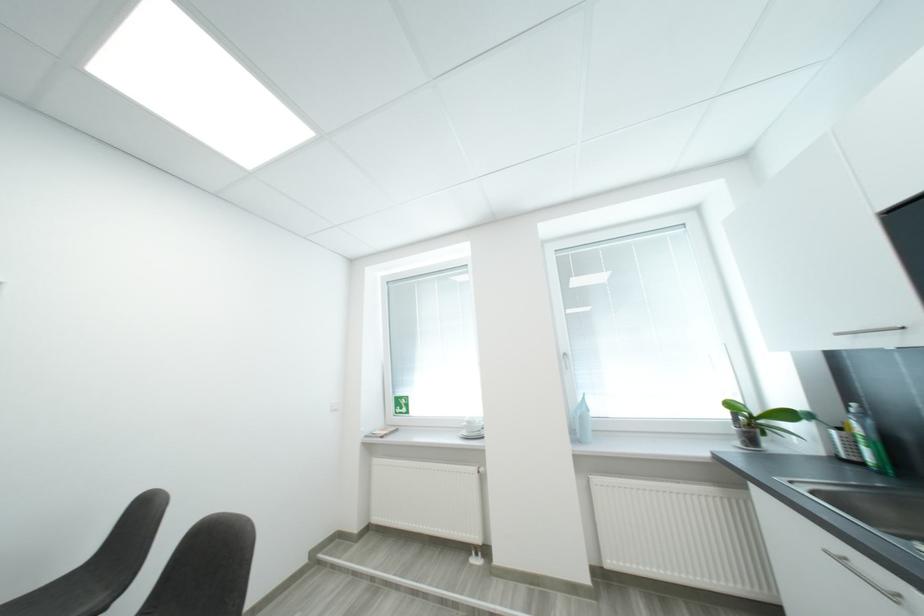
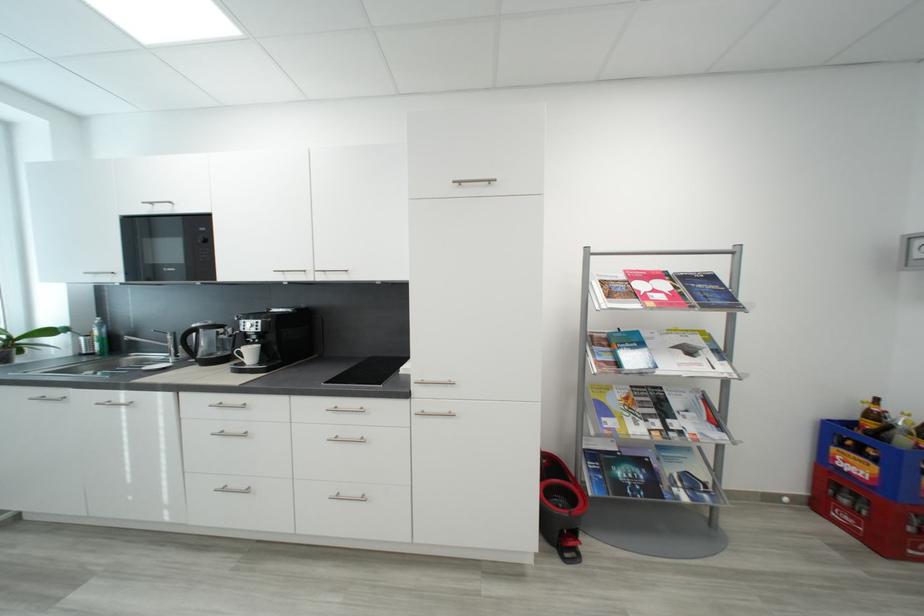
The point at [869,467] is marked in the first image. Where is the corresponding point in the second image?

(100, 355)